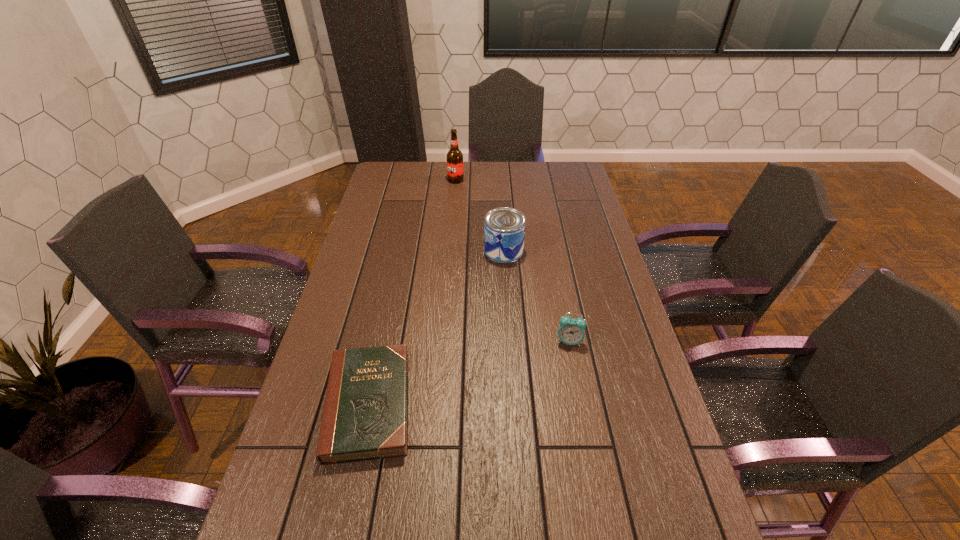
You are a GUI agent. You are given a task and a screenshot of the screen. Output one action in this format:
    pyautogui.click(x=<x>, y=<y>)
    Task: Click on the free space between the third nearest object and the Bible
    
    Given the screenshot: What is the action you would take?
    pyautogui.click(x=436, y=327)

Find the location of `object that stands as the closest to the leftmost object`. object that stands as the closest to the leftmost object is located at coordinates (x=571, y=331).

At what (x,y) coordinates should I click in order to perform the action: click on object that stands as the third closest to the third nearest object. Please return your answer as a coordinate pair (x, y). This screenshot has width=960, height=540. Looking at the image, I should click on (365, 416).